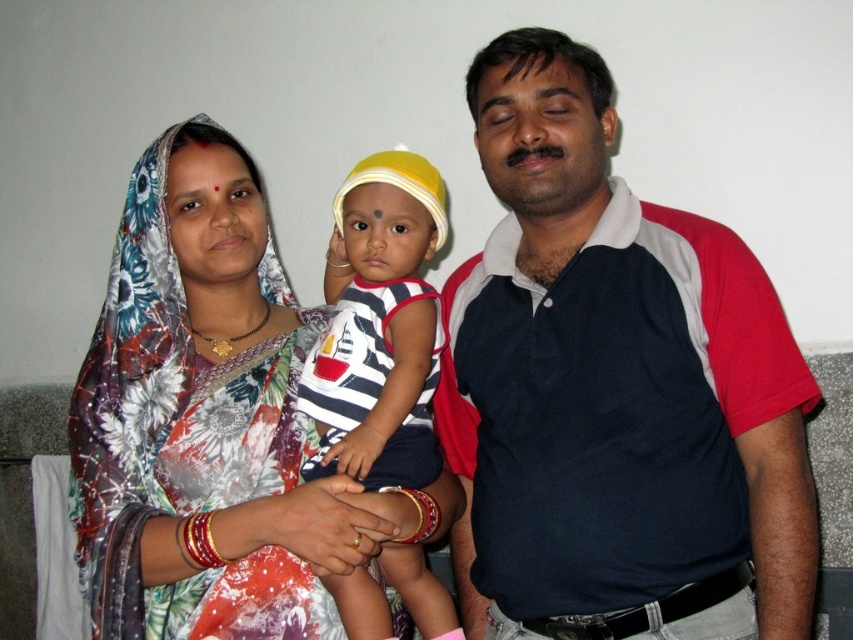
You are standing in the room and want to hand a gift to both the person wearing the dark blue polo shirt at right and the person wearing the floral fabric saree at center. Which one can you reach without moving closer?

The dark blue polo shirt at right is closer to the viewer than the floral fabric saree at center, so you can reach the person wearing the dark blue polo shirt at right without moving closer.

You are a photographer setting up a photo shoot in this scene. You need to adjust the camera height to focus on the dark blue polo shirt at right and the striped fabric shirt at center. Which shirt should you adjust the camera height to look up at?

The dark blue polo shirt at right has a greater height compared to the striped fabric shirt at center, so you should adjust the camera height to look up at the dark blue polo shirt at right.

What color is the clothing item located at the coordinates point (614, 388)?

The clothing item at point (614, 388) is dark blue.